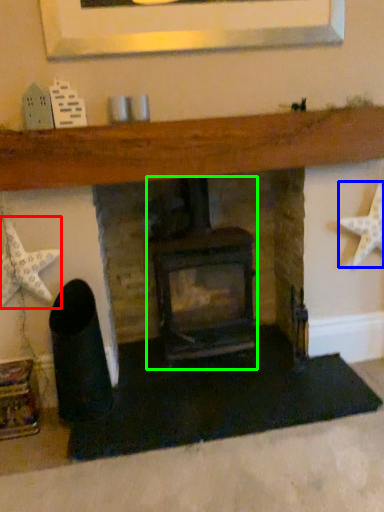
Question: Which is farther away from starfish (highlighted by a red box)? starfish (highlighted by a blue box) or wood burning stove (highlighted by a green box)?

Choices:
 (A) starfish
 (B) wood burning stove

Answer: (A)